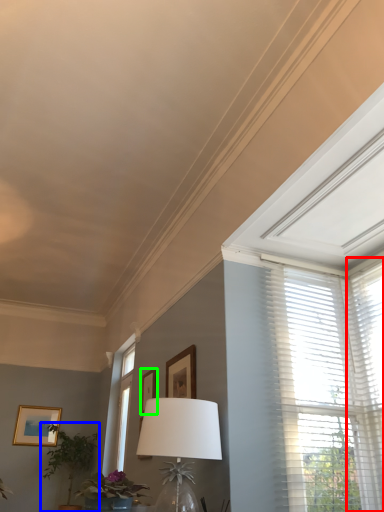
Question: Which is farther away from window blind (highlighted by a red box)? houseplant (highlighted by a blue box) or picture frame (highlighted by a green box)?

Choices:
 (A) houseplant
 (B) picture frame

Answer: (A)